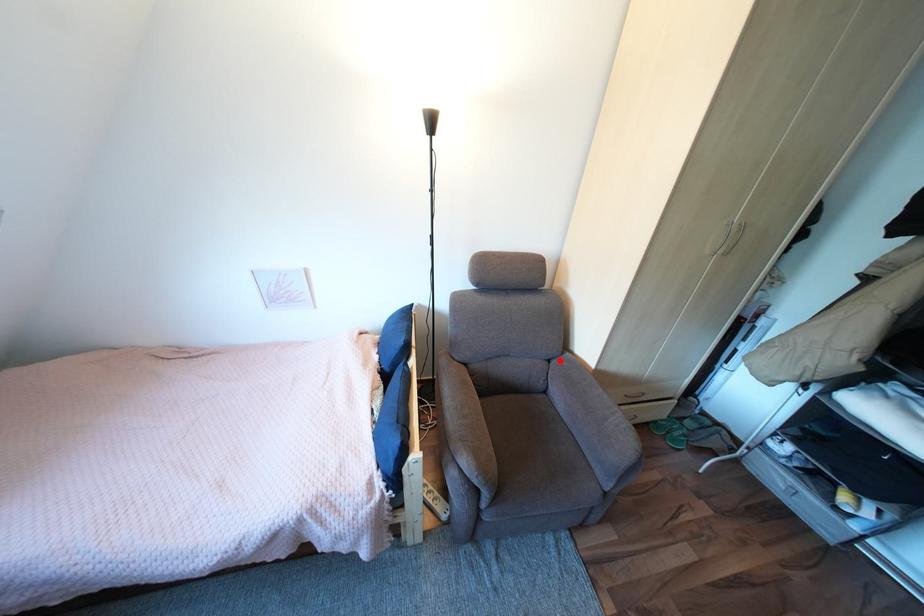
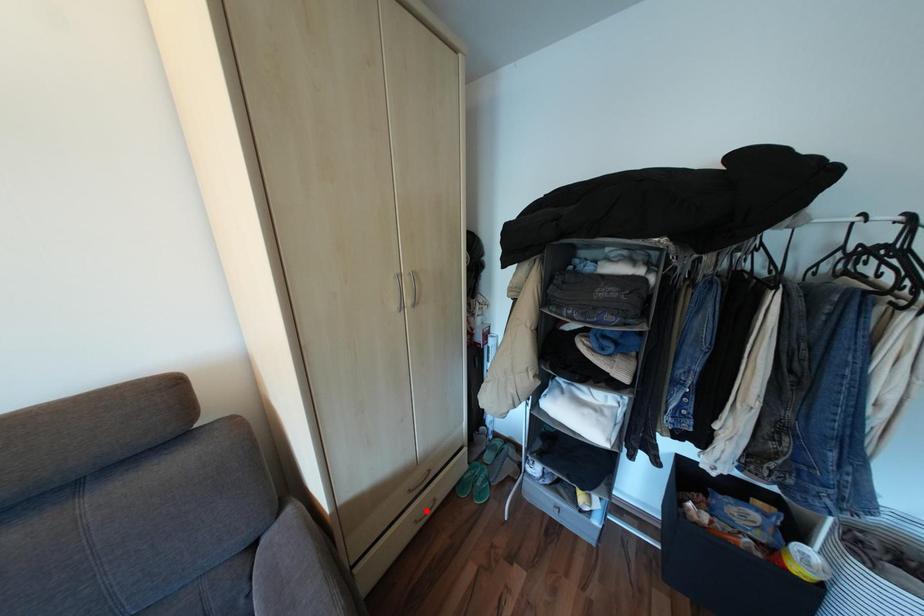
I am providing you with two images of the same scene from different viewpoints. A red point is marked on the first image and another point is marked on the second image. Does the point marked in image1 correspond to the same location as the one in image2?

No